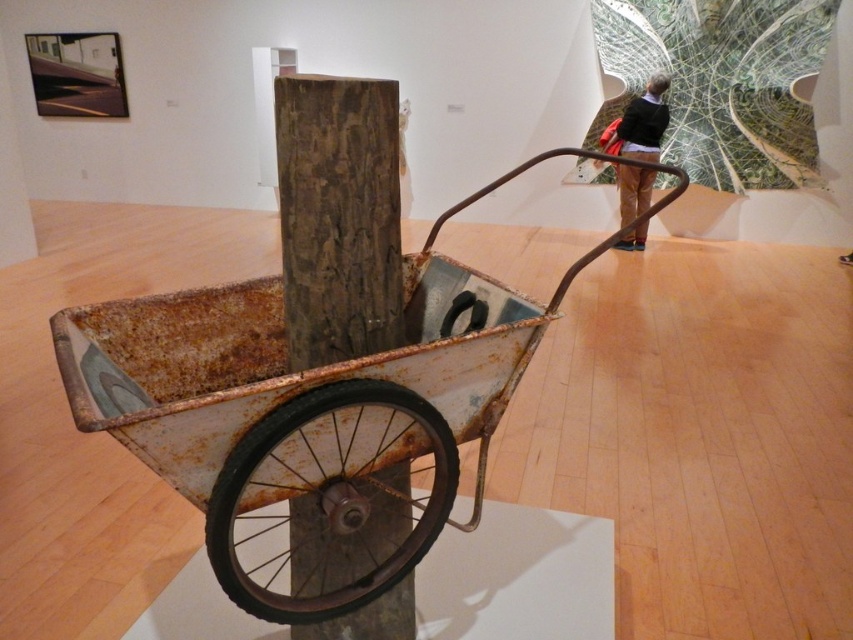
Question: Among these points, which one is nearest to the camera?

Choices:
 (A) (300, 499)
 (B) (328, 588)

Answer: (A)

Question: Does rusty metal cart at center come behind rusty metal wheel at center?

Choices:
 (A) yes
 (B) no

Answer: (B)

Question: Does rusty metal cart at center have a greater width compared to rusty metal wheel at center?

Choices:
 (A) yes
 (B) no

Answer: (A)

Question: Is rusty metal cart at center thinner than rusty metal wheel at center?

Choices:
 (A) yes
 (B) no

Answer: (B)

Question: Which of the following is the farthest from the observer?

Choices:
 (A) rusty metal wheel at center
 (B) rusty metal cart at center

Answer: (A)